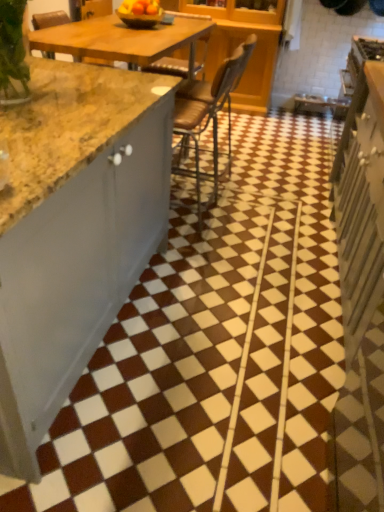
Question: From a real-world perspective, is white glossy cabinet at right positioned above or below matte yellow bowl at upper center?

Choices:
 (A) above
 (B) below

Answer: (B)

Question: Considering their positions, is white glossy cabinet at right located in front of or behind matte yellow bowl at upper center?

Choices:
 (A) front
 (B) behind

Answer: (A)

Question: Estimate the real-world distances between objects in this image. Which object is farther from the matte yellow bowl at upper center?

Choices:
 (A) brown leather chair at center
 (B) brown glossy tile at center
 (C) white glossy cabinet at right

Answer: (B)

Question: Which object is the closest to the matte yellow bowl at upper center?

Choices:
 (A) white glossy cabinet at right
 (B) brown leather chair at center
 (C) brown glossy tile at center

Answer: (B)